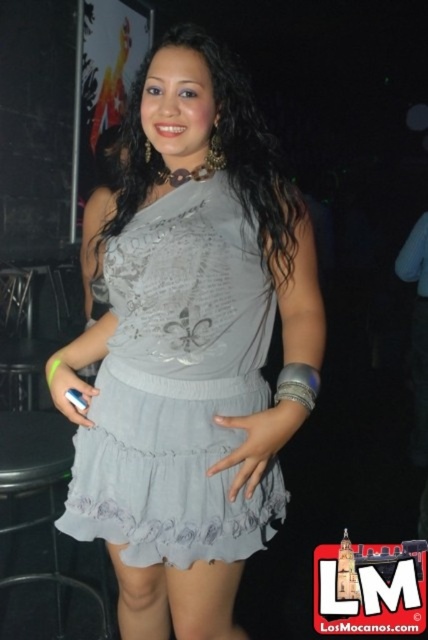
Question: Does black plastic bar stool at lower left have a smaller size compared to silver metallic ring at lower left?

Choices:
 (A) yes
 (B) no

Answer: (B)

Question: Does satin gray dress at center appear on the left side of satin fabric hand at center?

Choices:
 (A) yes
 (B) no

Answer: (A)

Question: Which of the following is the closest to the observer?

Choices:
 (A) (234, 497)
 (B) (15, 456)

Answer: (A)

Question: Is black plastic bar stool at lower left wider than silver metallic ring at lower left?

Choices:
 (A) yes
 (B) no

Answer: (A)

Question: Which point appears farthest from the camera in this image?

Choices:
 (A) (95, 394)
 (B) (26, 476)

Answer: (B)

Question: Among these objects, which one is farthest from the camera?

Choices:
 (A) silver metallic ring at lower left
 (B) satin gray dress at center
 (C) satin fabric hand at center
 (D) black plastic bar stool at lower left

Answer: (D)